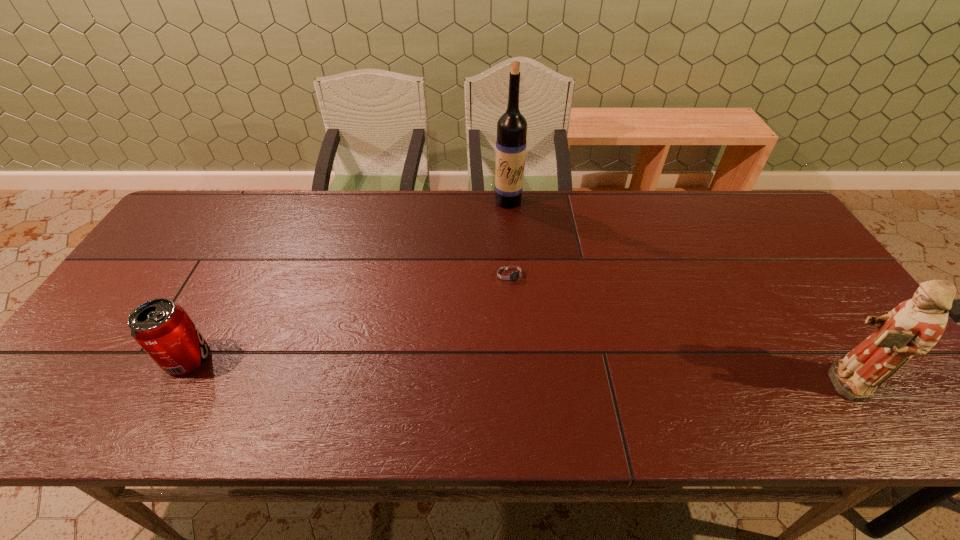
The height and width of the screenshot is (540, 960). What are the coordinates of `vacant space on the desktop that is between the second shortest object and the second tallest object and is positioned on the face of the watch` in the screenshot? It's located at (576, 373).

The image size is (960, 540). I want to click on free space on the desktop that is between the leftmost object and the figurine and is positioned on the label of the farthest object, so click(461, 368).